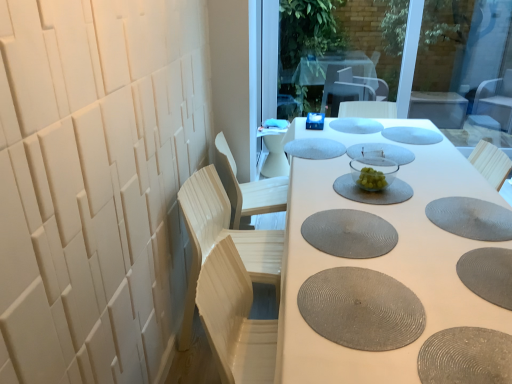
Where is `vacant area that lies between gray textured placemat at lower right, placed as the third manhole cover when sorted from front to back, and clear glass bowl at center, the sixth manhole cover positioned from the front`? vacant area that lies between gray textured placemat at lower right, placed as the third manhole cover when sorted from front to back, and clear glass bowl at center, the sixth manhole cover positioned from the front is located at coordinates (432, 224).